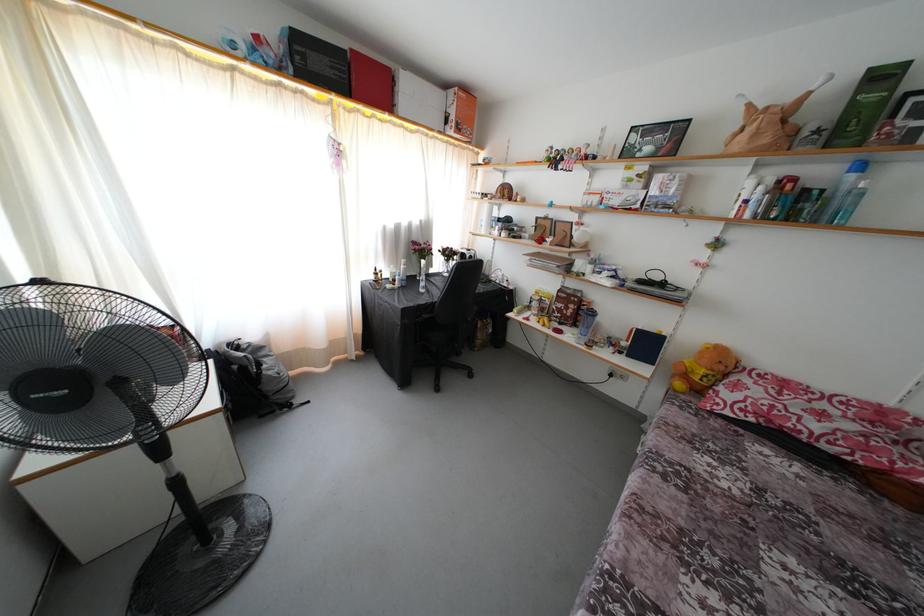
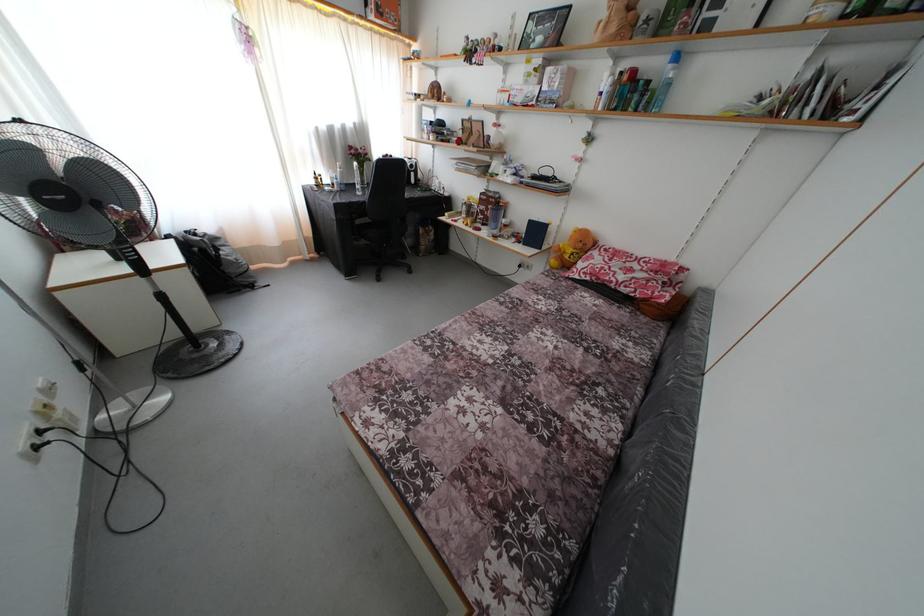
Locate, in the second image, the point that corresponds to point (565, 330) in the first image.

(488, 230)